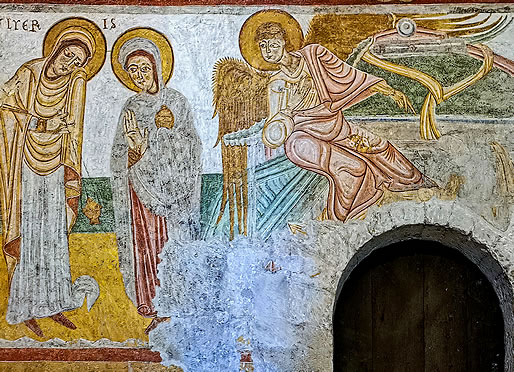
Where is `robes`? robes is located at coordinates (314, 129), (57, 102), (143, 113).